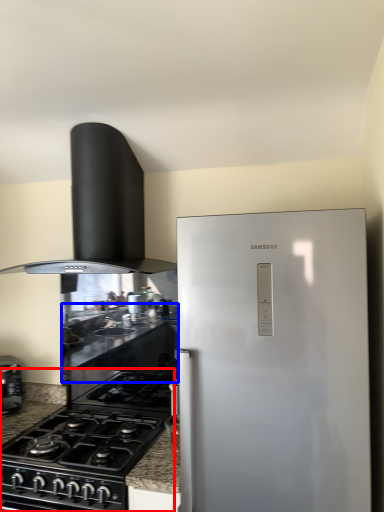
Question: Which point is closer to the camera, gas stove (highlighted by a red box) or counter top (highlighted by a blue box)?

Choices:
 (A) gas stove
 (B) counter top

Answer: (A)